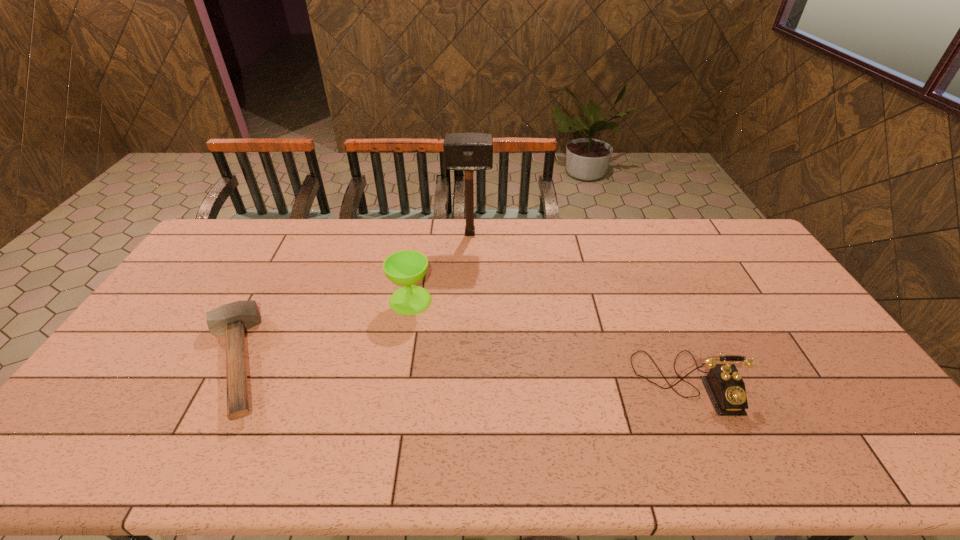
Find the location of a particular element. The width and height of the screenshot is (960, 540). object that is the third closest to the nearer mallet is located at coordinates tap(725, 386).

This screenshot has height=540, width=960. I want to click on free region that satisfies the following two spatial constraints: 1. on the back side of the wineglass; 2. on the right side of the tallest object, so click(x=421, y=233).